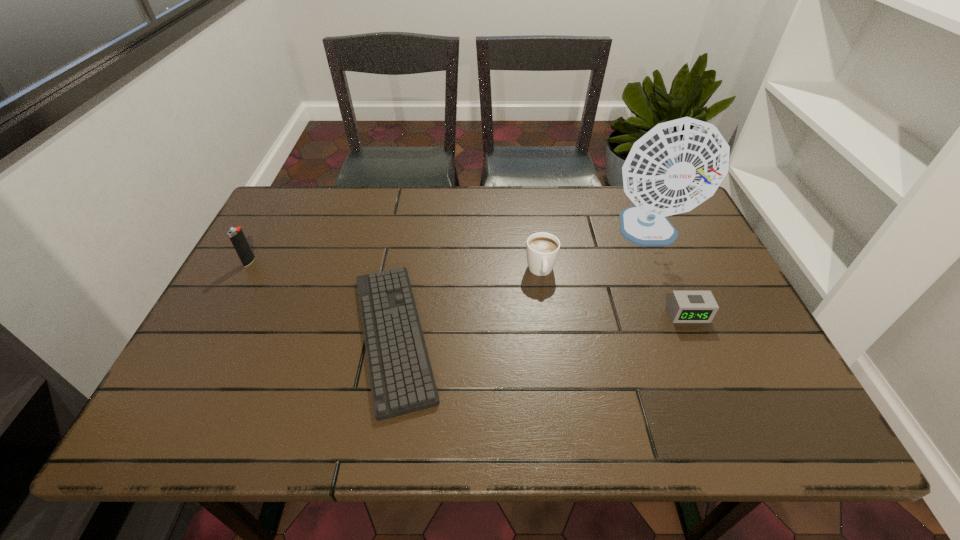
I want to click on the tallest object, so click(677, 165).

I want to click on the leftmost object, so click(x=236, y=235).

I want to click on the fourth shortest object, so click(x=236, y=235).

You are a GUI agent. You are given a task and a screenshot of the screen. Output one action in this format:
    pyautogui.click(x=<x>, y=<y>)
    Task: Click on the cappuccino
    Image resolution: width=960 pixels, height=540 pixels.
    Given the screenshot: What is the action you would take?
    pyautogui.click(x=542, y=249)

The height and width of the screenshot is (540, 960). In order to click on the third tallest object in this screenshot , I will do `click(542, 249)`.

Identify the location of the fourth tallest object. The height and width of the screenshot is (540, 960). (683, 306).

The width and height of the screenshot is (960, 540). In order to click on the fourth object from right to left in this screenshot , I will do `click(401, 378)`.

I want to click on the shortest object, so click(401, 378).

Where is `free space located on the grille of the tallest object`? free space located on the grille of the tallest object is located at coordinates (667, 276).

Find the location of `vacant space located 0.190m on the front of the igniter`. vacant space located 0.190m on the front of the igniter is located at coordinates (217, 322).